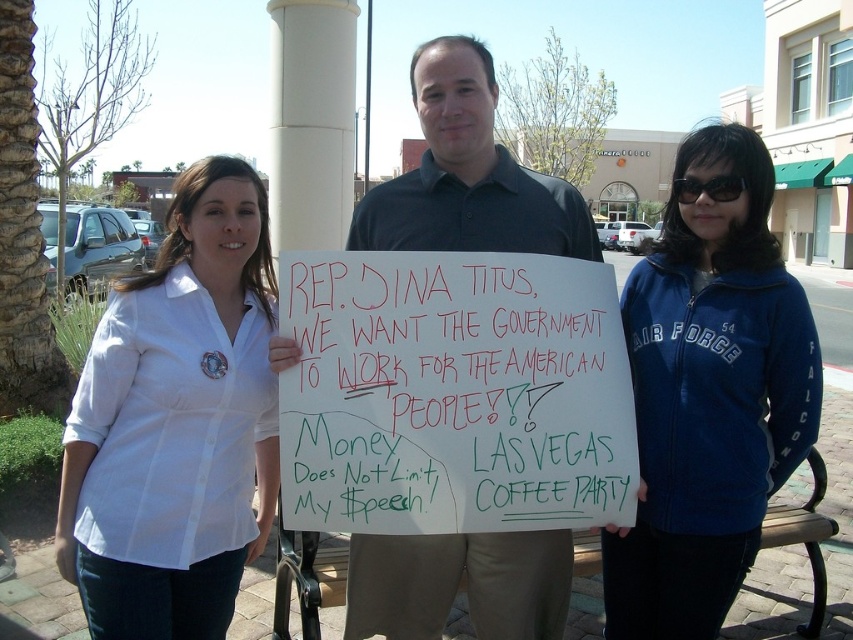
You are a photographer trying to capture a clear shot of the sign held by the central figure. You notice two points of interest marked at coordinates point (589, 266) and point (115, 506). Which point should you focus on to ensure the sign remains sharp in the photo?

Point (589, 266) is further to the viewer than point (115, 506), so focusing on point (589, 266) will ensure the sign remains sharp since it is closer to the camera.